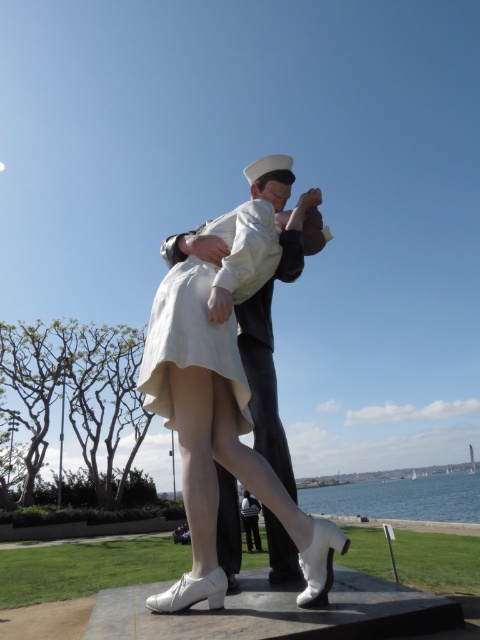
Which of these two, white glossy statue at center or white satin dress at center, stands taller?

With more height is white glossy statue at center.

Does white glossy statue at center have a greater width compared to white satin dress at center?

Indeed, white glossy statue at center has a greater width compared to white satin dress at center.

Does point (287, 179) come in front of point (173, 316)?

No, (287, 179) is further to viewer.

Find the location of a particular element. white glossy statue at center is located at coordinates (224, 392).

Looking at this image, how far apart are white glossy statue at center and blue water at lower center?

A distance of 35.79 meters exists between white glossy statue at center and blue water at lower center.

Is white glossy statue at center bigger than blue water at lower center?

Actually, white glossy statue at center might be smaller than blue water at lower center.

Identify the location of white glossy statue at center. (224, 392).

Which is above, white satin dress at center or blue water at lower center?

Positioned higher is white satin dress at center.

Is point (202, 276) positioned before point (477, 472)?

Yes.

Locate an element on the screen. white satin dress at center is located at coordinates (206, 310).